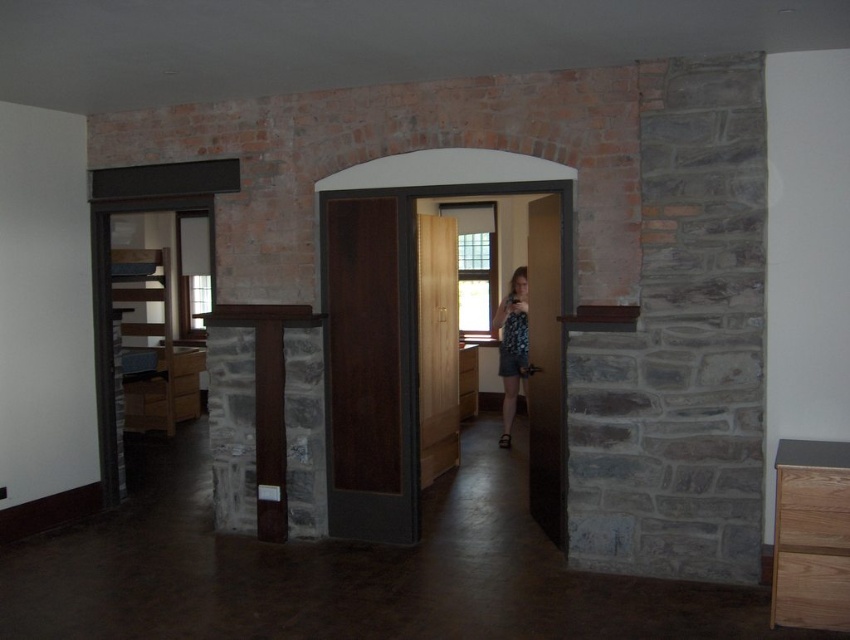
Question: Which of the following is the farthest from the observer?

Choices:
 (A) dark wood door at center
 (B) brown wooden door at center

Answer: (A)

Question: Among these objects, which one is nearest to the camera?

Choices:
 (A) printed fabric dress at center
 (B) brown wooden door at center

Answer: (B)

Question: Is wooden door at center above printed fabric dress at center?

Choices:
 (A) yes
 (B) no

Answer: (A)

Question: Which of the following is the farthest from the observer?

Choices:
 (A) brown wooden door at center
 (B) dark wood door at center
 (C) printed fabric dress at center

Answer: (C)

Question: Is dark wood door at center above wooden door at center?

Choices:
 (A) yes
 (B) no

Answer: (B)

Question: Is brown wooden door at center bigger than wooden door at center?

Choices:
 (A) yes
 (B) no

Answer: (B)